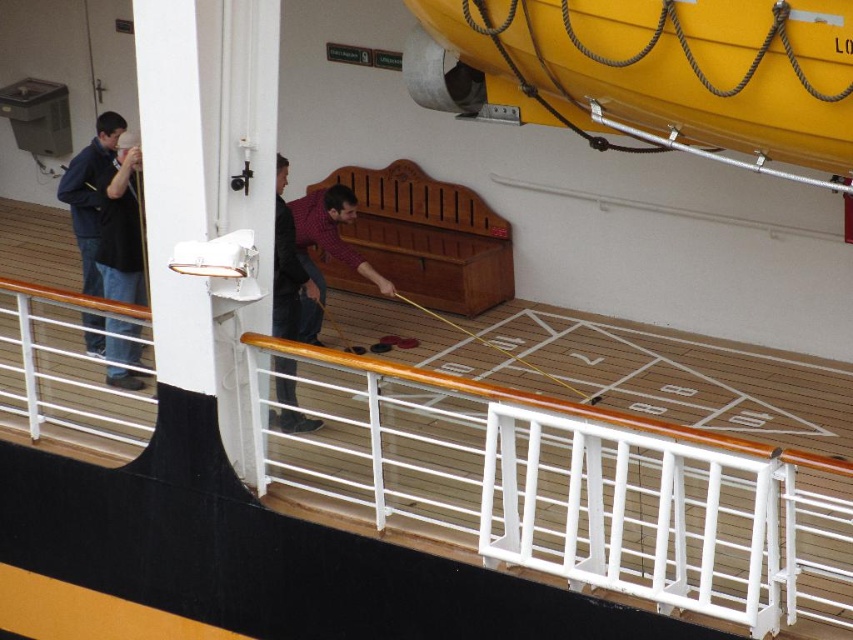
Question: Is black fabric shirt at left in front of plaid shirt at center?

Choices:
 (A) yes
 (B) no

Answer: (A)

Question: Does black fabric shirt at left have a larger size compared to plaid shirt at center?

Choices:
 (A) yes
 (B) no

Answer: (B)

Question: Which point appears farthest from the camera in this image?

Choices:
 (A) (107, 346)
 (B) (358, 257)

Answer: (B)

Question: Does plaid shirt at center appear over dark red shirt at center?

Choices:
 (A) no
 (B) yes

Answer: (B)

Question: Which of these objects is positioned closest to the dark red shirt at center?

Choices:
 (A) black fabric shirt at left
 (B) plaid shirt at center

Answer: (B)

Question: Which object appears farthest from the camera in this image?

Choices:
 (A) dark red shirt at center
 (B) black fabric shirt at left
 (C) plaid shirt at center

Answer: (C)